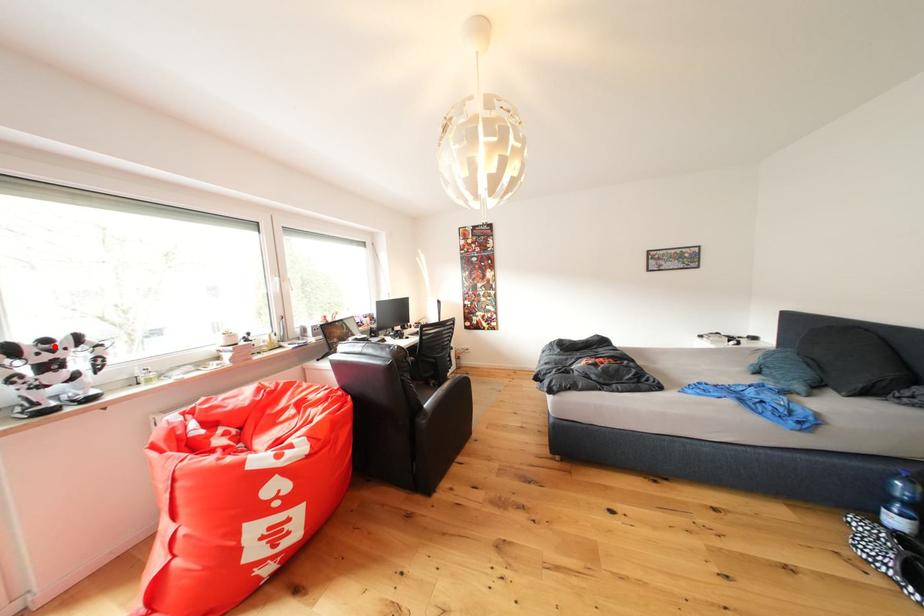
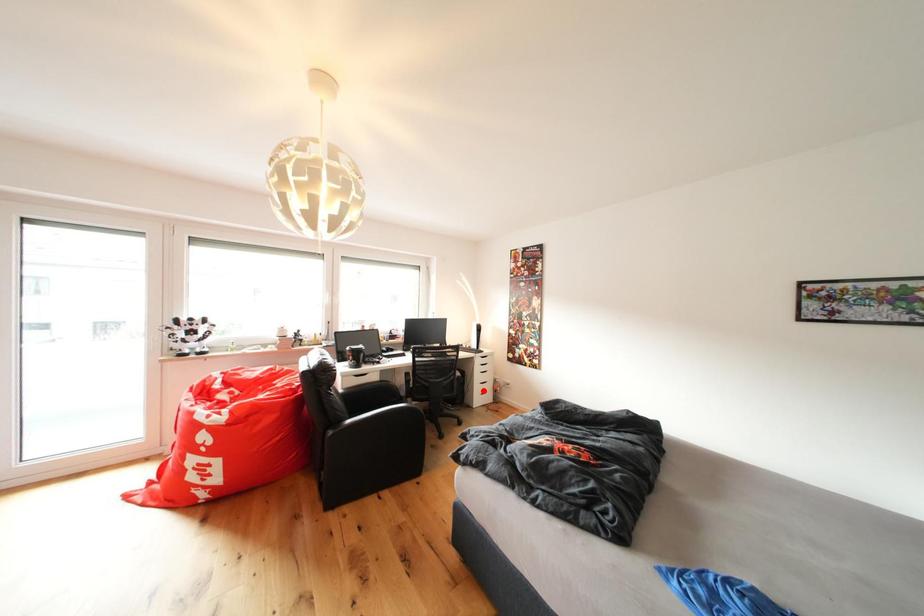
I am providing you with two images of the same scene from different viewpoints. A red point is marked on the first image and another point is marked on the second image. Does the point marked in image1 correspond to the same location as the one in image2?

No